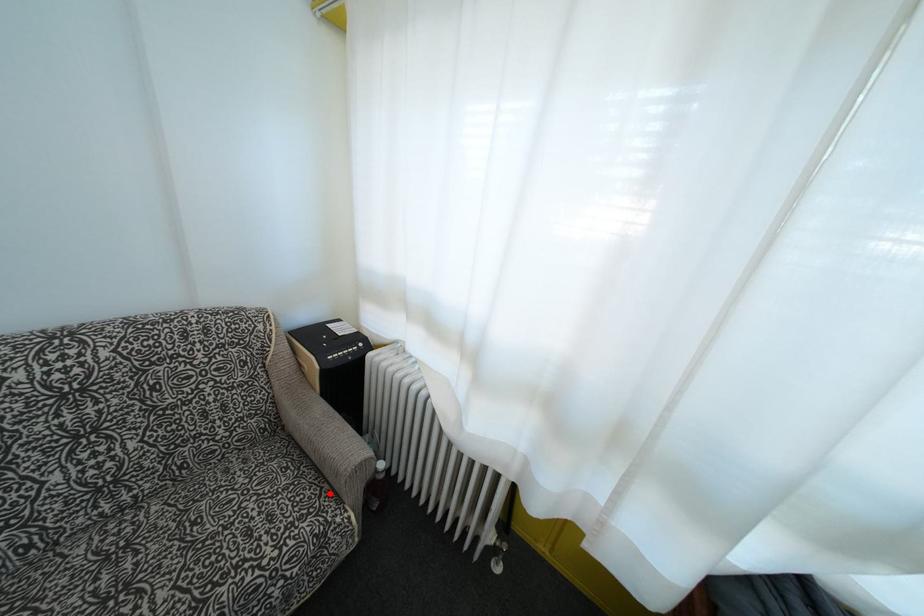
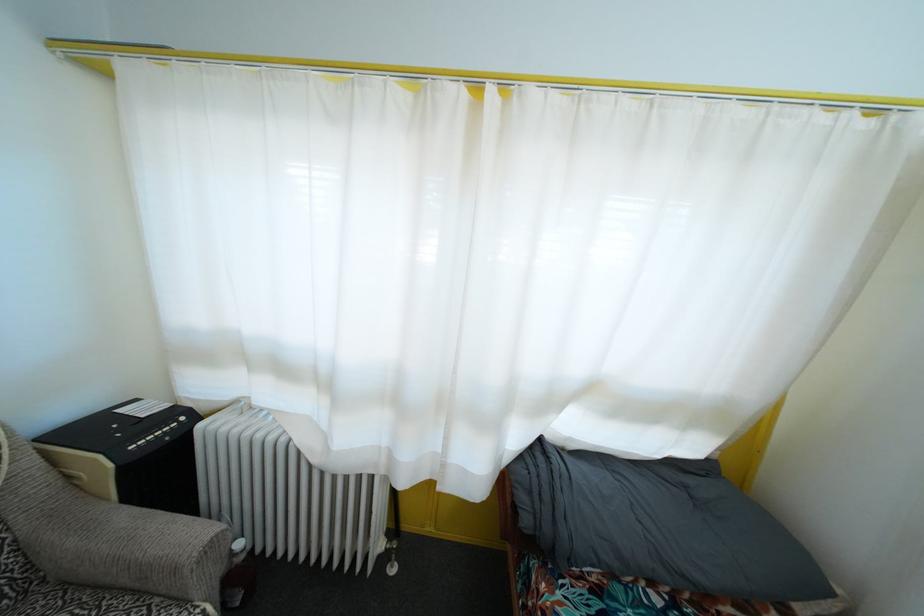
Find the pixel in the second image that matches the highlighted location in the first image.

(161, 608)